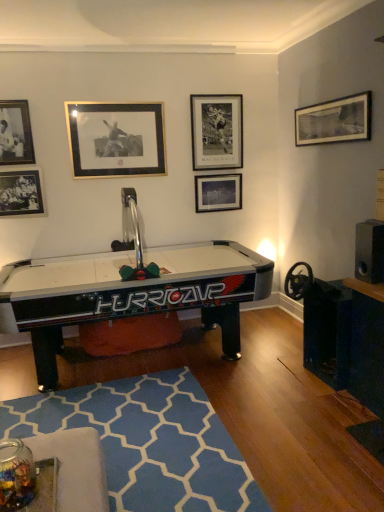
Question: Does matte black picture frame at upper left, the 6th picture frame from the right, appear on the left side of black plastic speaker at right?

Choices:
 (A) yes
 (B) no

Answer: (A)

Question: Is matte black picture frame at upper left, which is counted as the first picture frame, starting from the left, smaller than black plastic speaker at right?

Choices:
 (A) yes
 (B) no

Answer: (A)

Question: Can you confirm if matte black picture frame at upper left, the 6th picture frame from the right, is wider than black plastic speaker at right?

Choices:
 (A) yes
 (B) no

Answer: (B)

Question: Is matte black picture frame at upper left, which is counted as the first picture frame, starting from the left, not close to black plastic speaker at right?

Choices:
 (A) yes
 (B) no

Answer: (A)

Question: From a real-world perspective, is matte black picture frame at upper left, which is counted as the first picture frame, starting from the left, below black plastic speaker at right?

Choices:
 (A) no
 (B) yes

Answer: (A)

Question: Considering their positions, is black plastic air hockey table at center located in front of or behind matte black picture frame at upper right, arranged as the sixth picture frame when viewed from the left?

Choices:
 (A) behind
 (B) front

Answer: (B)

Question: From a real-world perspective, is black plastic air hockey table at center above or below matte black picture frame at upper right, the 1th picture frame positioned from the right?

Choices:
 (A) above
 (B) below

Answer: (B)

Question: From the image's perspective, relative to matte black picture frame at upper right, arranged as the sixth picture frame when viewed from the left, is black plastic air hockey table at center above or below?

Choices:
 (A) above
 (B) below

Answer: (B)

Question: Is point (241, 285) positioned closer to the camera than point (327, 139)?

Choices:
 (A) closer
 (B) farther

Answer: (A)

Question: In the image, is gold-framed print at upper center, which ranks as the 3th picture frame in left-to-right order, positioned in front of or behind matte black picture frame at center, which is counted as the 2th picture frame, starting from the right?

Choices:
 (A) behind
 (B) front

Answer: (B)

Question: Would you say gold-framed print at upper center, marked as the fourth picture frame in a right-to-left arrangement, is inside or outside matte black picture frame at center, which is counted as the 2th picture frame, starting from the right?

Choices:
 (A) outside
 (B) inside

Answer: (A)

Question: In the image, is gold-framed print at upper center, which ranks as the 3th picture frame in left-to-right order, on the left side or the right side of matte black picture frame at center, which is counted as the 2th picture frame, starting from the right?

Choices:
 (A) left
 (B) right

Answer: (A)

Question: Looking at their shapes, would you say gold-framed print at upper center, marked as the fourth picture frame in a right-to-left arrangement, is wider or thinner than matte black picture frame at center, which is counted as the 2th picture frame, starting from the right?

Choices:
 (A) wide
 (B) thin

Answer: (B)

Question: Considering the positions of matte black picture frame at upper right, arranged as the sixth picture frame when viewed from the left, and black plastic air hockey table at center in the image, is matte black picture frame at upper right, arranged as the sixth picture frame when viewed from the left, wider or thinner than black plastic air hockey table at center?

Choices:
 (A) thin
 (B) wide

Answer: (A)

Question: Is matte black picture frame at upper right, the 1th picture frame positioned from the right, situated inside black plastic air hockey table at center or outside?

Choices:
 (A) inside
 (B) outside

Answer: (B)